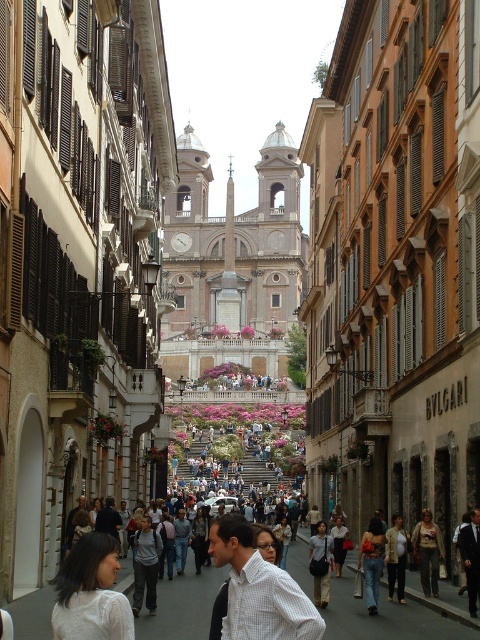
Question: Which object appears closest to the camera in this image?

Choices:
 (A) jeans at center
 (B) white cotton tank top at center
 (C) white matte shirt at lower left

Answer: (C)

Question: Among these points, which one is farthest from the camera?

Choices:
 (A) (372, 589)
 (B) (405, 600)
 (C) (430, 568)

Answer: (B)

Question: Does light gray shirt at center appear on the left side of jeans at center?

Choices:
 (A) no
 (B) yes

Answer: (B)

Question: Where is white matte shirt at lower left located in relation to light brown leather jacket at center in the image?

Choices:
 (A) above
 (B) below

Answer: (A)

Question: Based on their relative distances, which object is nearer to the light brown leather jacket at center?

Choices:
 (A) white matte shirt at lower left
 (B) light gray shirt at center
 (C) jeans at center
 (D) white cotton tank top at center

Answer: (D)

Question: Is white matte shirt at lower left further to camera compared to white cotton tank top at center?

Choices:
 (A) no
 (B) yes

Answer: (A)